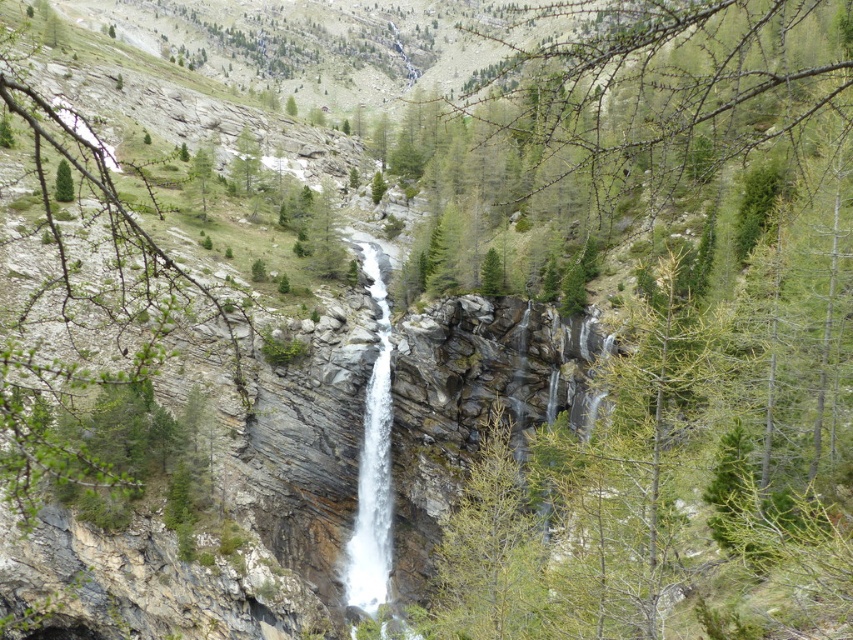
Based on the photo, between white smooth waterfall at center and green matte tree at upper left, which one is positioned higher?

green matte tree at upper left is higher up.

In the scene shown: Can you confirm if white smooth waterfall at center is thinner than green matte tree at upper left?

Indeed, white smooth waterfall at center has a lesser width compared to green matte tree at upper left.

What do you see at coordinates (373, 464) in the screenshot?
I see `white smooth waterfall at center` at bounding box center [373, 464].

Where is `white smooth waterfall at center`? white smooth waterfall at center is located at coordinates (373, 464).

Between green leafy branch at center and white smooth waterfall at center, which one appears on the left side from the viewer's perspective?

green leafy branch at center

Is green leafy branch at center to the left of white smooth waterfall at center from the viewer's perspective?

Yes, green leafy branch at center is to the left of white smooth waterfall at center.

Which is in front, point (146, 339) or point (361, 598)?

Point (361, 598)

Image resolution: width=853 pixels, height=640 pixels. I want to click on green leafy branch at center, so click(x=79, y=312).

Find the location of `green leafy branch at center`. green leafy branch at center is located at coordinates (79, 312).

Looking at this image, between green leafy branch at center and green matte tree at upper left, which one is positioned higher?

Positioned higher is green matte tree at upper left.

Measure the distance between point (105,198) and camera.

32.01 meters

The image size is (853, 640). In order to click on green leafy branch at center in this screenshot , I will do `click(79, 312)`.